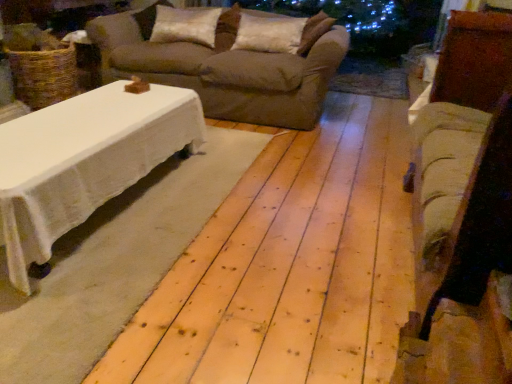
How much space does white soft pillow at upper center, the second pillow when ordered from right to left, occupy vertically?

white soft pillow at upper center, the second pillow when ordered from right to left, is 11.73 inches tall.

At what (x,y) coordinates should I click in order to perform the action: click on white soft pillow at upper center, the second pillow when ordered from right to left. Please return your answer as a coordinate pair (x, y). This screenshot has height=384, width=512. Looking at the image, I should click on click(x=185, y=25).

From the image's perspective, starting from the beige fabric couch at center, which pillow is the 2nd one above? Please provide its 2D coordinates.

[(185, 25)]

Which is closer to the camera, (x=169, y=32) or (x=163, y=79)?

The point (x=163, y=79) is closer.

Is white soft pillow at upper center, which is the first pillow from left to right, further to the viewer compared to beige fabric couch at center?

Yes, the depth of white soft pillow at upper center, which is the first pillow from left to right, is greater than that of beige fabric couch at center.

Who is taller, velvet beige armchair at right or beige fabric couch at center?

Standing taller between the two is velvet beige armchair at right.

From a real-world perspective, which is physically above, velvet beige armchair at right or beige fabric couch at center?

velvet beige armchair at right, from a real-world perspective.

Looking at this image, considering the relative sizes of velvet beige armchair at right and beige fabric couch at center in the image provided, is velvet beige armchair at right wider than beige fabric couch at center?

Incorrect, the width of velvet beige armchair at right does not surpass that of beige fabric couch at center.

From the picture: Can you tell me how much velvet beige armchair at right and beige fabric couch at center differ in facing direction?

89.7 degrees separate the facing orientations of velvet beige armchair at right and beige fabric couch at center.

Which object is wider, satin white pillow at center, which ranks as the 1th pillow in right-to-left order, or white soft pillow at upper center, the second pillow when ordered from right to left?

Wider between the two is white soft pillow at upper center, the second pillow when ordered from right to left.

Between satin white pillow at center, which ranks as the 1th pillow in right-to-left order, and white soft pillow at upper center, the second pillow when ordered from right to left, which one has less height?

white soft pillow at upper center, the second pillow when ordered from right to left, is shorter.

Between satin white pillow at center, which ranks as the 1th pillow in right-to-left order, and white soft pillow at upper center, the second pillow when ordered from right to left, which one appears on the right side from the viewer's perspective?

satin white pillow at center, which ranks as the 1th pillow in right-to-left order.

Is satin white pillow at center, which ranks as the 2th pillow in left-to-right order, aimed at white soft pillow at upper center, the second pillow when ordered from right to left?

No, satin white pillow at center, which ranks as the 2th pillow in left-to-right order, is not aimed at white soft pillow at upper center, the second pillow when ordered from right to left.

Which is more to the left, white soft pillow at upper center, which is the first pillow from left to right, or velvet beige armchair at right?

white soft pillow at upper center, which is the first pillow from left to right.

Is point (212, 18) positioned before point (500, 47)?

No, it is not.

Is white soft pillow at upper center, which is the first pillow from left to right, bigger or smaller than velvet beige armchair at right?

In the image, white soft pillow at upper center, which is the first pillow from left to right, appears to be smaller than velvet beige armchair at right.

Which object is further away from the camera taking this photo, white soft pillow at upper center, the second pillow when ordered from right to left, or velvet beige armchair at right?

Positioned behind is white soft pillow at upper center, the second pillow when ordered from right to left.

Is point (437, 208) farther from viewer compared to point (197, 36)?

No, it is in front of (197, 36).

Where is `armchair that is in front of the white soft pillow at upper center, the second pillow when ordered from right to left`? Image resolution: width=512 pixels, height=384 pixels. armchair that is in front of the white soft pillow at upper center, the second pillow when ordered from right to left is located at coordinates click(x=464, y=164).

Is velvet beige armchair at right completely or partially outside of white soft pillow at upper center, which is the first pillow from left to right?

Yes, velvet beige armchair at right is outside of white soft pillow at upper center, which is the first pillow from left to right.

How different are the orientations of velvet beige armchair at right and white soft pillow at upper center, which is the first pillow from left to right, in degrees?

velvet beige armchair at right and white soft pillow at upper center, which is the first pillow from left to right, are facing 89.7 degrees away from each other.

From the image's perspective, between beige fabric couch at center and satin white pillow at center, which ranks as the 1th pillow in right-to-left order, who is located below?

beige fabric couch at center is shown below in the image.

From a real-world perspective, is beige fabric couch at center physically below satin white pillow at center, which ranks as the 2th pillow in left-to-right order?

Yes, from a real-world perspective, beige fabric couch at center is under satin white pillow at center, which ranks as the 2th pillow in left-to-right order.

Is beige fabric couch at center outside of satin white pillow at center, which ranks as the 2th pillow in left-to-right order?

Yes, beige fabric couch at center is not within satin white pillow at center, which ranks as the 2th pillow in left-to-right order.

Considering the relative positions of beige fabric couch at center and satin white pillow at center, which ranks as the 1th pillow in right-to-left order, in the image provided, is beige fabric couch at center to the left of satin white pillow at center, which ranks as the 1th pillow in right-to-left order, from the viewer's perspective?

Correct, you'll find beige fabric couch at center to the left of satin white pillow at center, which ranks as the 1th pillow in right-to-left order.

Looking at this image, is velvet beige armchair at right shorter than satin white pillow at center, which ranks as the 2th pillow in left-to-right order?

No, velvet beige armchair at right is not shorter than satin white pillow at center, which ranks as the 2th pillow in left-to-right order.

Is velvet beige armchair at right to the left of satin white pillow at center, which ranks as the 2th pillow in left-to-right order, from the viewer's perspective?

Incorrect, velvet beige armchair at right is not on the left side of satin white pillow at center, which ranks as the 2th pillow in left-to-right order.

From the velvet beige armchair at right, count 1st pillows backward and point to it. Please provide its 2D coordinates.

[(269, 34)]

Is satin white pillow at center, which ranks as the 2th pillow in left-to-right order, a part of velvet beige armchair at right?

Definitely not — satin white pillow at center, which ranks as the 2th pillow in left-to-right order, is not inside velvet beige armchair at right.

Where is `studio couch to the right of white soft pillow at upper center, which is the first pillow from left to right`? studio couch to the right of white soft pillow at upper center, which is the first pillow from left to right is located at coordinates (224, 71).

Where is `armchair located above the beige fabric couch at center (from a real-world perspective)`? This screenshot has width=512, height=384. armchair located above the beige fabric couch at center (from a real-world perspective) is located at coordinates [x=464, y=164].

Looking at this image, estimate the real-world distances between objects in this image. Which object is closer to beige fabric couch at center, velvet beige armchair at right or white soft pillow at upper center, the second pillow when ordered from right to left?

white soft pillow at upper center, the second pillow when ordered from right to left, lies closer to beige fabric couch at center than the other object.

From the image, which object appears to be farther from satin white pillow at center, which ranks as the 2th pillow in left-to-right order, white soft pillow at upper center, the second pillow when ordered from right to left, or beige fabric couch at center?

Based on the image, white soft pillow at upper center, the second pillow when ordered from right to left, appears to be further to satin white pillow at center, which ranks as the 2th pillow in left-to-right order.

Based on their spatial positions, is satin white pillow at center, which ranks as the 2th pillow in left-to-right order, or velvet beige armchair at right further from beige fabric couch at center?

velvet beige armchair at right lies further to beige fabric couch at center than the other object.

From the image, which object appears to be nearer to velvet beige armchair at right, white soft pillow at upper center, the second pillow when ordered from right to left, or satin white pillow at center, which ranks as the 1th pillow in right-to-left order?

Based on the image, satin white pillow at center, which ranks as the 1th pillow in right-to-left order, appears to be nearer to velvet beige armchair at right.

Looking at the image, which one is located closer to velvet beige armchair at right, satin white pillow at center, which ranks as the 2th pillow in left-to-right order, or beige fabric couch at center?

beige fabric couch at center lies closer to velvet beige armchair at right than the other object.

Considering their positions, is velvet beige armchair at right positioned closer to beige fabric couch at center than satin white pillow at center, which ranks as the 1th pillow in right-to-left order?

Based on the image, satin white pillow at center, which ranks as the 1th pillow in right-to-left order, appears to be nearer to beige fabric couch at center.

Estimate the real-world distances between objects in this image. Which object is further from beige fabric couch at center, white soft pillow at upper center, the second pillow when ordered from right to left, or satin white pillow at center, which ranks as the 1th pillow in right-to-left order?

satin white pillow at center, which ranks as the 1th pillow in right-to-left order, lies further to beige fabric couch at center than the other object.

Which object lies further to the anchor point white soft pillow at upper center, which is the first pillow from left to right, velvet beige armchair at right or beige fabric couch at center?

Based on the image, velvet beige armchair at right appears to be further to white soft pillow at upper center, which is the first pillow from left to right.

This screenshot has height=384, width=512. What are the coordinates of `studio couch positioned between velvet beige armchair at right and white soft pillow at upper center, the second pillow when ordered from right to left, from near to far` in the screenshot? It's located at (224, 71).

Find the location of a particular element. pillow between beige fabric couch at center and white soft pillow at upper center, which is the first pillow from left to right, in the front-back direction is located at coordinates 269,34.

At what (x,y) coordinates should I click in order to perform the action: click on pillow between velvet beige armchair at right and white soft pillow at upper center, the second pillow when ordered from right to left, along the z-axis. Please return your answer as a coordinate pair (x, y). The height and width of the screenshot is (384, 512). Looking at the image, I should click on (269, 34).

Where is `studio couch located between velvet beige armchair at right and satin white pillow at center, which ranks as the 1th pillow in right-to-left order, in the depth direction`? This screenshot has height=384, width=512. studio couch located between velvet beige armchair at right and satin white pillow at center, which ranks as the 1th pillow in right-to-left order, in the depth direction is located at coordinates (224, 71).